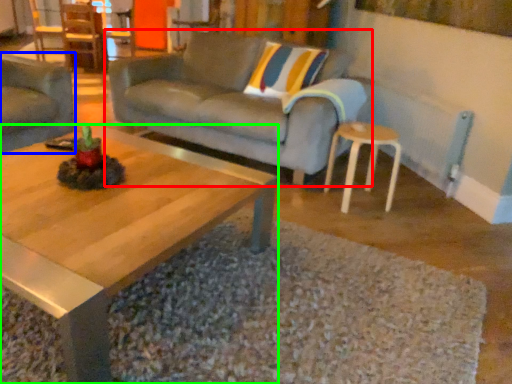
Question: Which object is positioned farthest from studio couch (highlighted by a red box)? Select from studio couch (highlighted by a blue box) and coffee table (highlighted by a green box).

Choices:
 (A) studio couch
 (B) coffee table

Answer: (B)